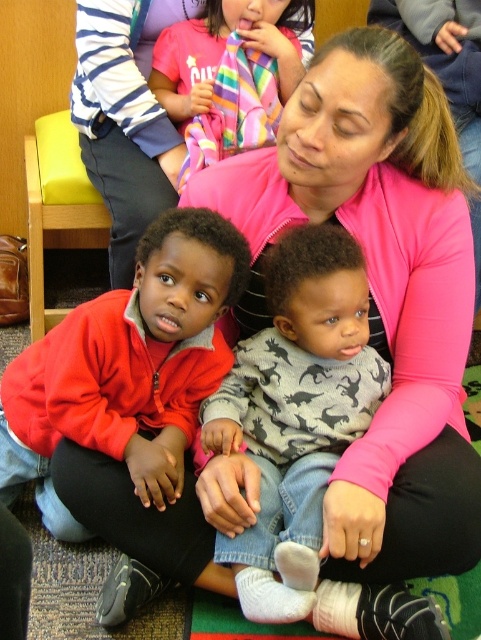
Question: Which point is closer to the camera?

Choices:
 (A) (140, 349)
 (B) (290, 605)

Answer: (B)

Question: Which object appears farthest from the camera in this image?

Choices:
 (A) rainbow striped scarf at upper center
 (B) gray cotton sweater at center

Answer: (A)

Question: Is red fleece jacket at center smaller than pink zip-up jacket at upper center?

Choices:
 (A) yes
 (B) no

Answer: (B)

Question: Is red fleece jacket at center to the left of gray cotton sweater at center from the viewer's perspective?

Choices:
 (A) yes
 (B) no

Answer: (A)

Question: Is gray cotton sweater at center bigger than pink zip-up jacket at upper center?

Choices:
 (A) no
 (B) yes

Answer: (B)

Question: Which point is closer to the camera?

Choices:
 (A) gray cotton sweater at center
 (B) red fleece jacket at center

Answer: (A)